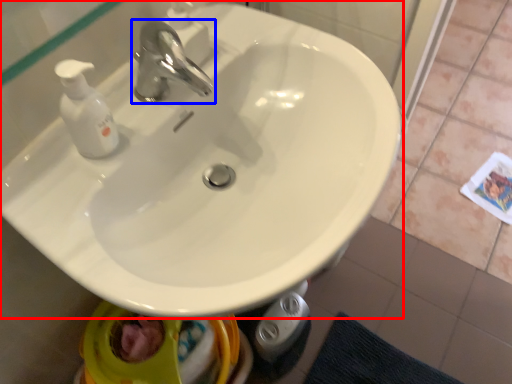
Question: Which of the following is the closest to the observer, sink (highlighted by a red box) or tap (highlighted by a blue box)?

Choices:
 (A) sink
 (B) tap

Answer: (A)